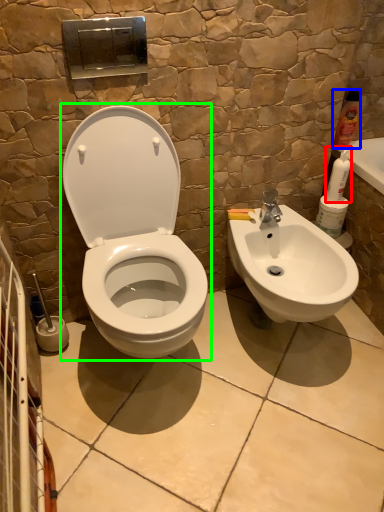
Question: Considering the real-world distances, which object is closest to cleaning product (highlighted by a red box)? cleaning product (highlighted by a blue box) or toilet (highlighted by a green box).

Choices:
 (A) cleaning product
 (B) toilet

Answer: (A)